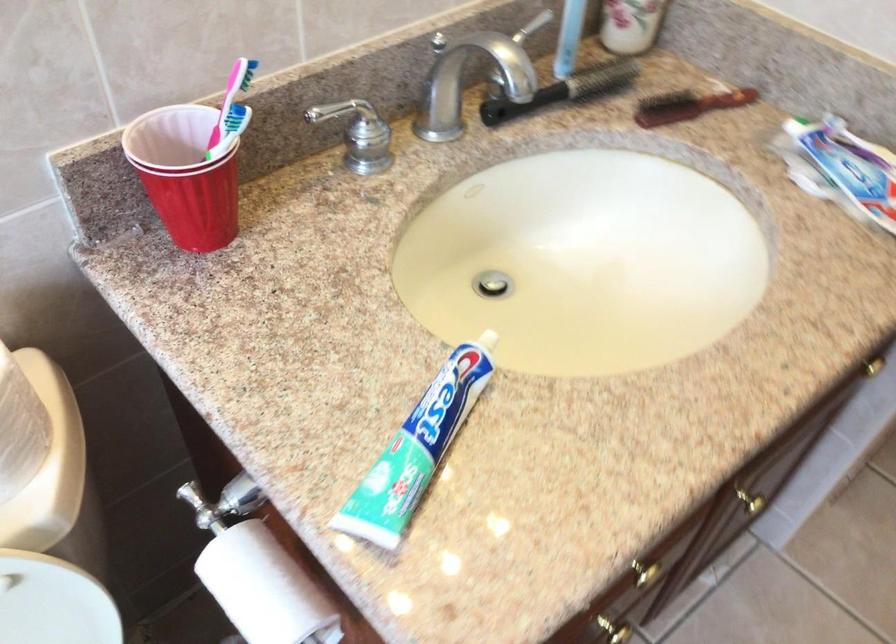
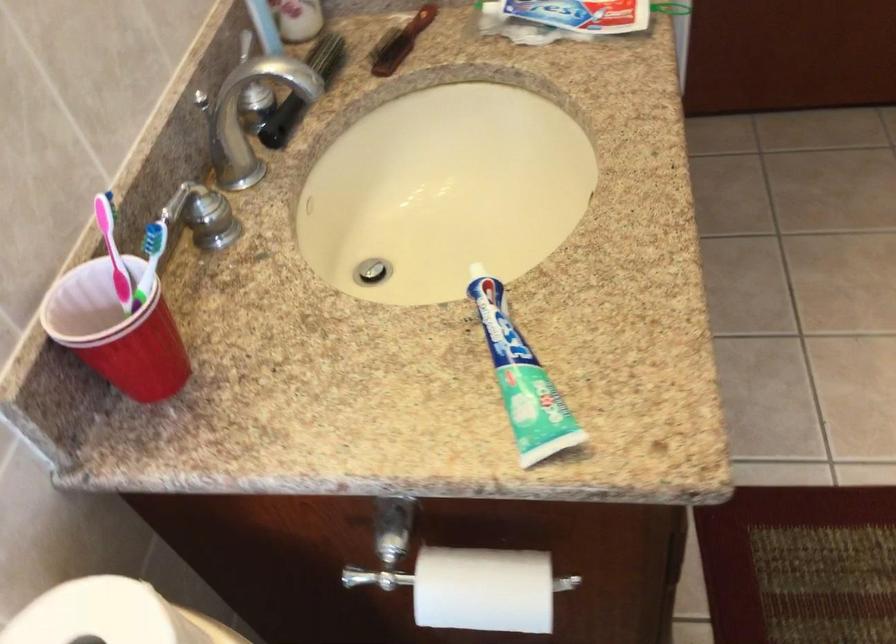
Find the pixel in the second image that matches point 362,135 in the first image.

(207, 212)